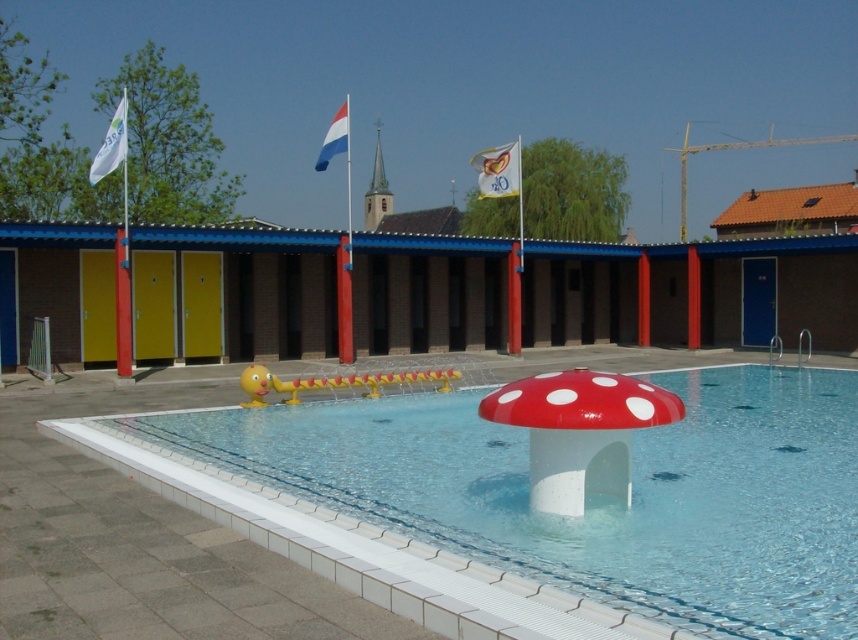
Question: In this image, where is white fabric flag at upper center located relative to white fabric flag at upper left?

Choices:
 (A) left
 (B) right

Answer: (B)

Question: Does white glossy mushroom at center come in front of white fabric flag at upper center?

Choices:
 (A) yes
 (B) no

Answer: (A)

Question: Can you confirm if white glossy mushroom at center is bigger than white fabric flag at upper center?

Choices:
 (A) yes
 (B) no

Answer: (B)

Question: Which object is the closest to the red-white-blue fabric flag at upper center?

Choices:
 (A) white fabric flag at upper center
 (B) white glossy mushroom at center
 (C) white fabric flag at upper left

Answer: (A)

Question: Considering the real-world distances, which object is farthest from the white glossy mushroom at center?

Choices:
 (A) red-white-blue fabric flag at upper center
 (B) white fabric flag at upper center
 (C) white fabric flag at upper left

Answer: (B)

Question: Which of these objects is positioned farthest from the white glossy mushroom at center?

Choices:
 (A) red-white-blue fabric flag at upper center
 (B) white fabric flag at upper left

Answer: (A)